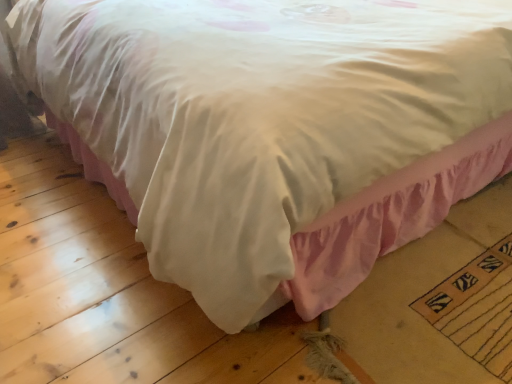
Find the location of a particular element. free point above yellow woven mat at lower right (from a real-world perspective) is located at coordinates (483, 295).